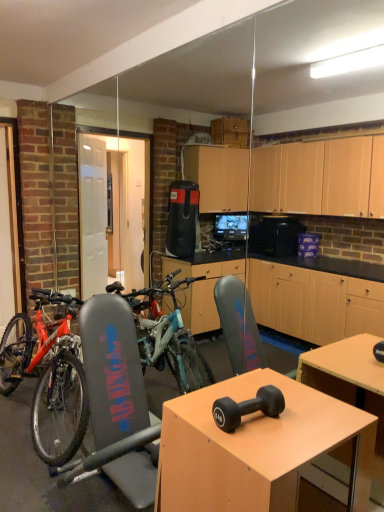
Where is `vacant space in front of black rubber dumbbell at center`? The height and width of the screenshot is (512, 384). vacant space in front of black rubber dumbbell at center is located at coordinates (262, 449).